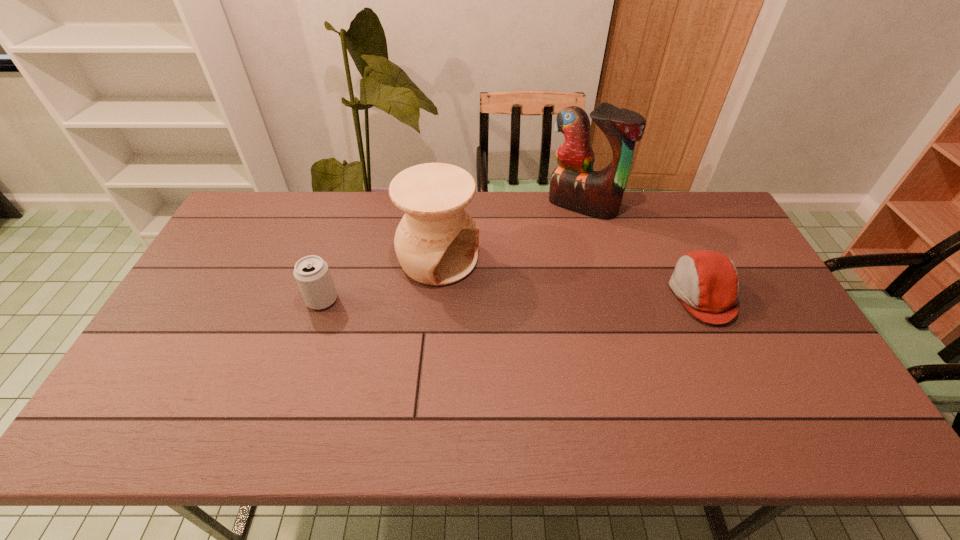
This screenshot has width=960, height=540. In order to click on object present at the right edge in this screenshot , I will do `click(707, 282)`.

In order to click on vacant space at the far edge of the desktop in this screenshot , I will do `click(396, 208)`.

At what (x,y) coordinates should I click in order to perform the action: click on blank space at the near edge of the desktop. Please return your answer as a coordinate pair (x, y). The width and height of the screenshot is (960, 540). Looking at the image, I should click on (312, 376).

In the image, there is a desktop. What are the coordinates of `vacant region at the left edge` in the screenshot? It's located at (253, 269).

The height and width of the screenshot is (540, 960). I want to click on vacant space at the right edge of the desktop, so click(696, 242).

You are a GUI agent. You are given a task and a screenshot of the screen. Output one action in this format:
    pyautogui.click(x=<x>, y=<y>)
    Task: Click on the free space at the far right corner
    This screenshot has height=540, width=960.
    Given the screenshot: What is the action you would take?
    pyautogui.click(x=731, y=233)

The height and width of the screenshot is (540, 960). Identify the location of unoccupied position between the parrot and the shortest object. click(x=642, y=250).

Locate an element on the screen. vacant area between the shortest object and the tallest object is located at coordinates (642, 250).

Locate an element on the screen. This screenshot has width=960, height=540. vacant point located between the leftmost object and the third shortest object is located at coordinates (380, 280).

Locate an element on the screen. free spot between the tallest object and the cap is located at coordinates [x=642, y=250].